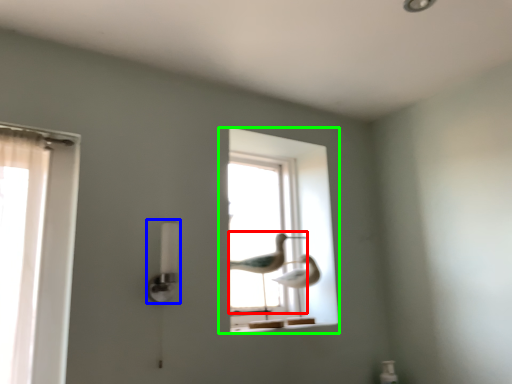
Question: Considering the real-world distances, which object is closest to bird (highlighted by a red box)? lamp (highlighted by a blue box) or window (highlighted by a green box).

Choices:
 (A) lamp
 (B) window

Answer: (B)